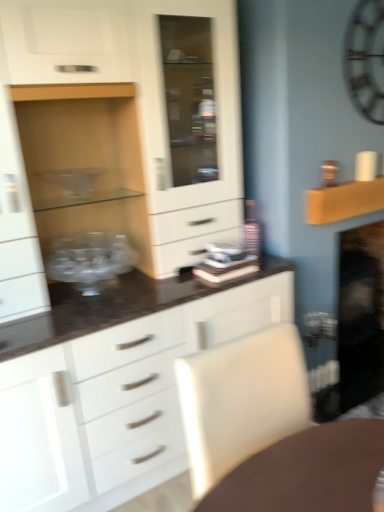
Question: Is white matte cabinet at center wider or thinner than transparent glass bowl at left?

Choices:
 (A) wide
 (B) thin

Answer: (A)

Question: From the image's perspective, relative to transparent glass bowl at left, is white matte cabinet at center above or below?

Choices:
 (A) above
 (B) below

Answer: (A)

Question: Which of these objects is positioned farthest from the white matte cabinet at center?

Choices:
 (A) transparent glass bowl at left
 (B) metallic silver clock at upper right
 (C) wooden shelf at upper right
 (D) white leather swivel chair at lower right

Answer: (D)

Question: Estimate the real-world distances between objects in this image. Which object is closer to the transparent glass bowl at left?

Choices:
 (A) white matte cabinet at center
 (B) wooden shelf at upper right
 (C) metallic silver clock at upper right
 (D) white leather swivel chair at lower right

Answer: (A)